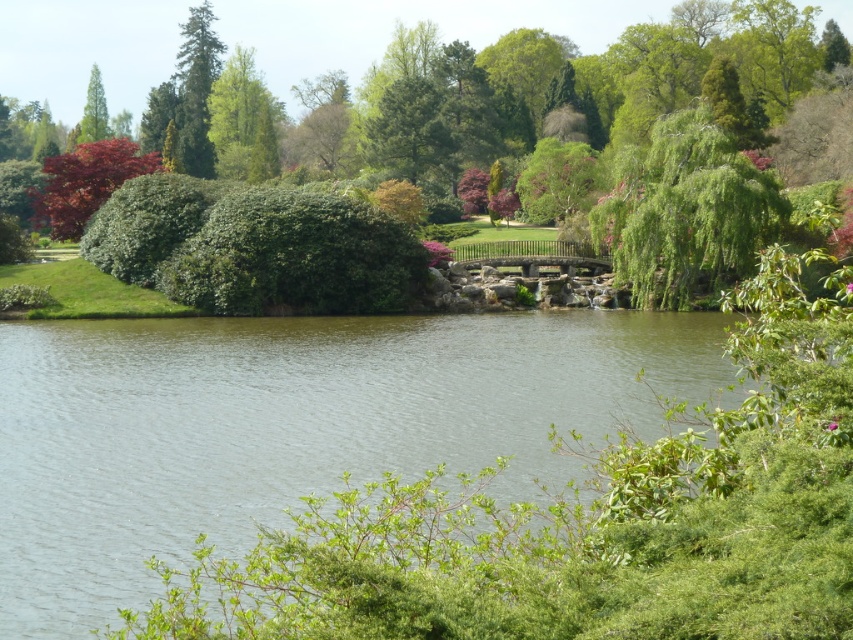
Question: Among these objects, which one is nearest to the camera?

Choices:
 (A) green textured tree at upper left
 (B) green leafy bush at upper center
 (C) green matte tree at upper left

Answer: (B)

Question: Which object is closer to the camera taking this photo?

Choices:
 (A) green leafy bush at upper center
 (B) shiny red maple tree at upper left
 (C) green leafy tree at upper left

Answer: (A)

Question: Does green leafy bush at upper center appear on the right side of green textured tree at upper left?

Choices:
 (A) no
 (B) yes

Answer: (B)

Question: Is green smooth water at center thinner than green textured tree at upper left?

Choices:
 (A) no
 (B) yes

Answer: (A)

Question: Can you confirm if green leafy tree at upper left is positioned below green textured tree at upper left?

Choices:
 (A) yes
 (B) no

Answer: (A)

Question: Among these objects, which one is farthest from the camera?

Choices:
 (A) green matte tree at upper left
 (B) green textured tree at upper left
 (C) green leafy tree at upper left
 (D) green smooth water at center

Answer: (A)